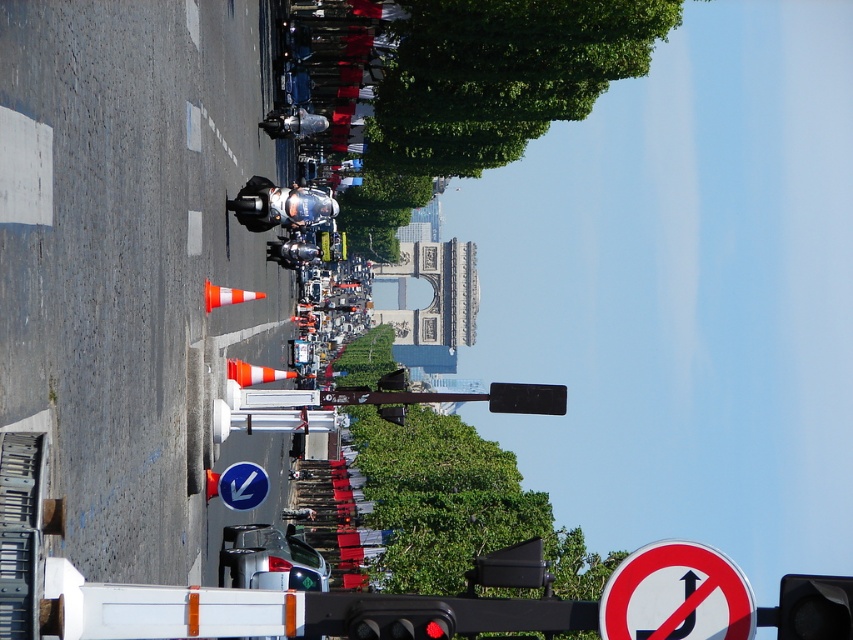
Can you confirm if black plastic traffic light at center is bigger than red glass traffic light at center?

Correct, black plastic traffic light at center is larger in size than red glass traffic light at center.

Which is more to the left, black plastic traffic light at center or red glass traffic light at center?

red glass traffic light at center

Identify the location of black plastic traffic light at center. (814, 608).

Is red glass traffic light at center wider than blue plastic arrow at lower center?

Result: Yes.

Looking at this image, which of these two, red glass traffic light at center or blue plastic arrow at lower center, stands shorter?

Standing shorter between the two is blue plastic arrow at lower center.

What do you see at coordinates (401, 624) in the screenshot? The height and width of the screenshot is (640, 853). I see `red glass traffic light at center` at bounding box center [401, 624].

Identify the location of red glass traffic light at center. The width and height of the screenshot is (853, 640). (401, 624).

Is white plastic sign at lower right to the left of blue plastic arrow at lower center from the viewer's perspective?

Incorrect, white plastic sign at lower right is not on the left side of blue plastic arrow at lower center.

Can you confirm if white plastic sign at lower right is taller than blue plastic arrow at lower center?

Yes.

Describe the element at coordinates (676, 595) in the screenshot. I see `white plastic sign at lower right` at that location.

Find the location of a particular element. The width and height of the screenshot is (853, 640). white plastic sign at lower right is located at coordinates (676, 595).